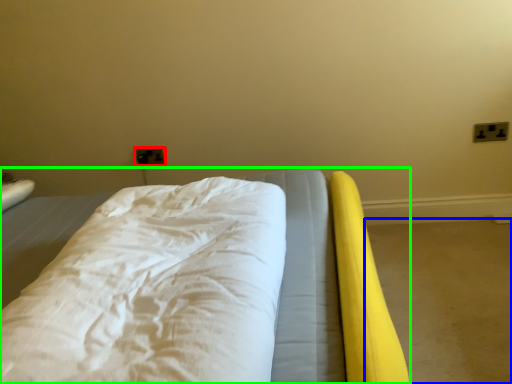
Question: Which object is the closest to the electric outlet (highlighted by a red box)? Choose among these: concrete (highlighted by a blue box) or bed (highlighted by a green box).

Choices:
 (A) concrete
 (B) bed

Answer: (B)